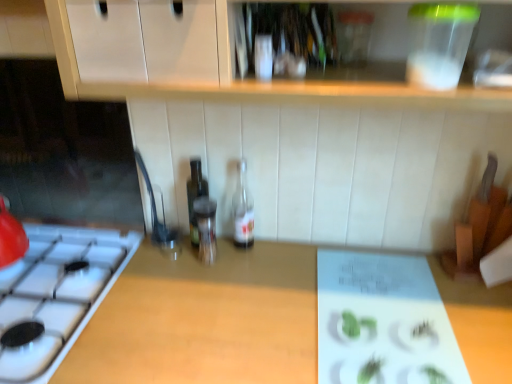
Find the location of `vacant space to the right of clear glass bottle at center, acting as the 3th bottle starting from the left`. vacant space to the right of clear glass bottle at center, acting as the 3th bottle starting from the left is located at coordinates [x=280, y=254].